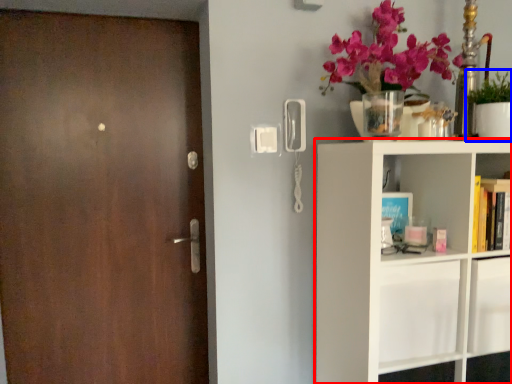
Question: Which point is closer to the camera, shelf (highlighted by a red box) or houseplant (highlighted by a blue box)?

Choices:
 (A) shelf
 (B) houseplant

Answer: (A)